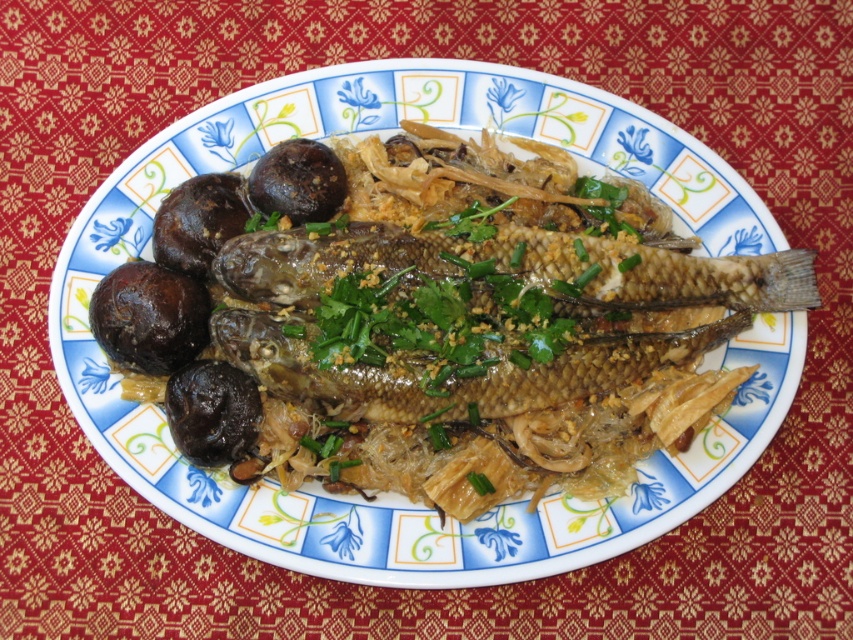
Question: Which is farther from the brown glossy mushrooms at left?

Choices:
 (A) glossy brown fish at center
 (B) golden brown fish at center

Answer: (B)

Question: Observing the image, what is the correct spatial positioning of brown glossy mushrooms at left in reference to golden brown fish at center?

Choices:
 (A) below
 (B) above

Answer: (A)

Question: Is brown glossy mushrooms at left thinner than golden brown fish at center?

Choices:
 (A) yes
 (B) no

Answer: (B)

Question: Which point is farther to the camera?

Choices:
 (A) glossy brown fish at center
 (B) brown glossy mushrooms at left
 (C) golden brown fish at center

Answer: (A)

Question: Which point is farther from the camera taking this photo?

Choices:
 (A) click(x=225, y=244)
 (B) click(x=577, y=396)

Answer: (A)

Question: Can you confirm if brown glossy mushrooms at left is positioned above glossy brown fish at center?

Choices:
 (A) yes
 (B) no

Answer: (A)